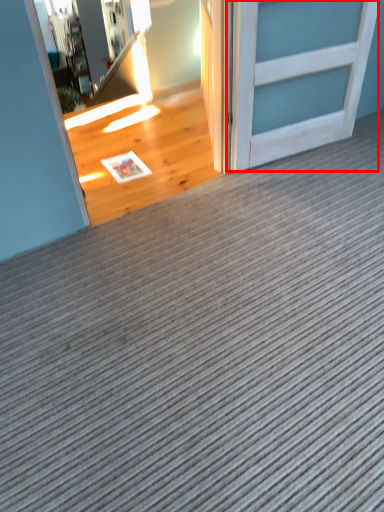
Question: From the image's perspective, considering the relative positions of door (annotated by the red box) and door in the image provided, where is door (annotated by the red box) located with respect to the staircase?

Choices:
 (A) above
 (B) below

Answer: (B)